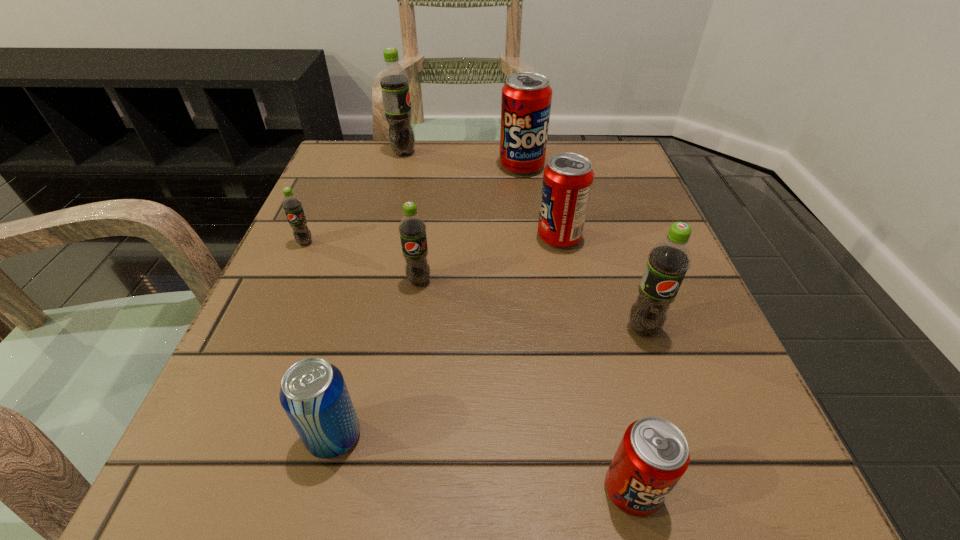
The width and height of the screenshot is (960, 540). In order to click on vacant area located on the front label of the third nearest green soda in this screenshot , I will do `click(231, 407)`.

Where is `vacant space situated on the back of the nearest object`? vacant space situated on the back of the nearest object is located at coordinates (606, 383).

Find the location of a particular element. beer can situated at the near edge is located at coordinates (313, 393).

Where is `soda can positioned at the near edge`? soda can positioned at the near edge is located at coordinates (653, 455).

You are a GUI agent. You are given a task and a screenshot of the screen. Output one action in this format:
    pyautogui.click(x=<x>, y=<y>)
    Task: Click on the beer can at the left edge
    
    Given the screenshot: What is the action you would take?
    pyautogui.click(x=313, y=393)

The width and height of the screenshot is (960, 540). Find the location of `object located at the far left corner`. object located at the far left corner is located at coordinates (394, 82).

The height and width of the screenshot is (540, 960). Find the location of `object that is at the near left corner`. object that is at the near left corner is located at coordinates (313, 393).

At what (x,y) coordinates should I click in order to perform the action: click on object that is at the near right corner. Please return your answer as a coordinate pair (x, y). Looking at the image, I should click on (653, 455).

You are a GUI agent. You are given a task and a screenshot of the screen. Output one action in this format:
    pyautogui.click(x=<x>, y=<y>)
    Task: Click on the vacant area at the far edge
    The height and width of the screenshot is (540, 960).
    Given the screenshot: What is the action you would take?
    pyautogui.click(x=526, y=188)

Identify the location of free space at the near edge. (552, 484).